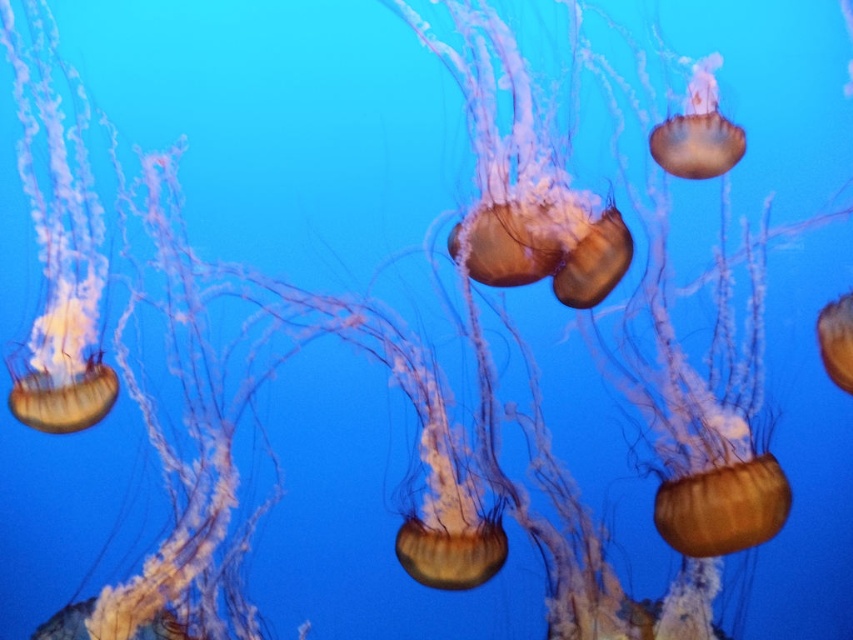
You are an underwater photographer aiming to capture a clear shot of both the translucent golden jellyfish at upper right and the translucent golden jellyfish at right. Which jellyfish is closer to the camera?

The translucent golden jellyfish at upper right is positioned over the translucent golden jellyfish at right, so it is closer to the camera.

You are a marine biologist observing this underwater scene. You notice two jellyfish species here. The translucent gelatinous at left and the translucent golden jellyfish at right. Based on their positions, which one is closer to the surface of the water?

The translucent gelatinous at left is closer to the surface of the water because it is positioned above the translucent golden jellyfish at right.